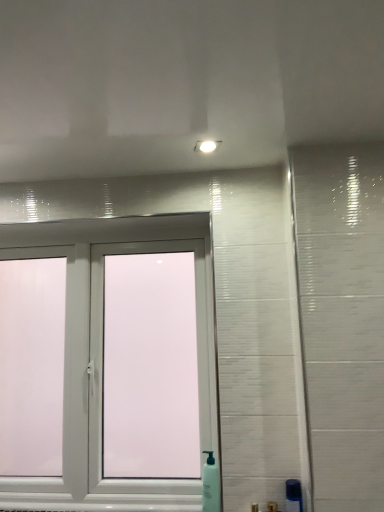
What are the coordinates of `white plastic window at center` in the screenshot? It's located at (102, 355).

This screenshot has height=512, width=384. What do you see at coordinates (102, 355) in the screenshot? I see `white plastic window at center` at bounding box center [102, 355].

In order to click on green translucent soap dispenser at lower right, acting as the second soap dispenser starting from the left in this screenshot , I will do `click(293, 496)`.

Who is bigger, green translucent soap dispenser at lower right, the second soap dispenser when ordered from back to front, or white plastic soap dispenser at lower center, arranged as the 1th soap dispenser when viewed from the back?

Bigger between the two is white plastic soap dispenser at lower center, arranged as the 1th soap dispenser when viewed from the back.

Is green translucent soap dispenser at lower right, acting as the second soap dispenser starting from the left, beside white plastic soap dispenser at lower center, placed as the second soap dispenser when sorted from front to back?

No, green translucent soap dispenser at lower right, acting as the second soap dispenser starting from the left, is not next to white plastic soap dispenser at lower center, placed as the second soap dispenser when sorted from front to back.

From a real-world perspective, is green translucent soap dispenser at lower right, which appears as the first soap dispenser when viewed from the front, located higher than white plastic soap dispenser at lower center, positioned as the first soap dispenser in left-to-right order?

No, from a real-world perspective, green translucent soap dispenser at lower right, which appears as the first soap dispenser when viewed from the front, is not over white plastic soap dispenser at lower center, positioned as the first soap dispenser in left-to-right order

Is green translucent soap dispenser at lower right, the second soap dispenser when ordered from back to front, completely or partially outside of white plastic soap dispenser at lower center, placed as the second soap dispenser when sorted from front to back?

Yes, green translucent soap dispenser at lower right, the second soap dispenser when ordered from back to front, is outside of white plastic soap dispenser at lower center, placed as the second soap dispenser when sorted from front to back.

From a real-world perspective, is green translucent soap dispenser at lower right, the second soap dispenser when ordered from back to front, positioned under white plastic window at center based on gravity?

Yes, from a real-world perspective, green translucent soap dispenser at lower right, the second soap dispenser when ordered from back to front, is under white plastic window at center.

Considering the sizes of objects green translucent soap dispenser at lower right, which appears as the first soap dispenser when viewed from the front, and white plastic window at center in the image provided, who is bigger, green translucent soap dispenser at lower right, which appears as the first soap dispenser when viewed from the front, or white plastic window at center?

Bigger between the two is white plastic window at center.

Is green translucent soap dispenser at lower right, marked as the first soap dispenser in a right-to-left arrangement, aimed at white plastic window at center?

No, green translucent soap dispenser at lower right, marked as the first soap dispenser in a right-to-left arrangement, is not oriented towards white plastic window at center.

Is white plastic window at center bigger than green translucent soap dispenser at lower right, acting as the second soap dispenser starting from the left?

Indeed, white plastic window at center has a larger size compared to green translucent soap dispenser at lower right, acting as the second soap dispenser starting from the left.

Based on the photo, is white plastic window at center wider or thinner than green translucent soap dispenser at lower right, marked as the first soap dispenser in a right-to-left arrangement?

Clearly, white plastic window at center has more width compared to green translucent soap dispenser at lower right, marked as the first soap dispenser in a right-to-left arrangement.

From the image's perspective, is white plastic window at center above green translucent soap dispenser at lower right, acting as the second soap dispenser starting from the left?

Yes, from the image's perspective, white plastic window at center is above green translucent soap dispenser at lower right, acting as the second soap dispenser starting from the left.

Which object is closer to the camera, white plastic window at center or white plastic soap dispenser at lower center, placed as the second soap dispenser when sorted from front to back?

white plastic soap dispenser at lower center, placed as the second soap dispenser when sorted from front to back, is in front.

Looking at the image, does white plastic window at center seem bigger or smaller compared to white plastic soap dispenser at lower center, placed as the second soap dispenser when sorted from front to back?

In the image, white plastic window at center appears to be larger than white plastic soap dispenser at lower center, placed as the second soap dispenser when sorted from front to back.

Can you see white plastic window at center touching white plastic soap dispenser at lower center, which is the 2th soap dispenser from right to left?

No, white plastic window at center is not in contact with white plastic soap dispenser at lower center, which is the 2th soap dispenser from right to left.

Is white plastic soap dispenser at lower center, positioned as the first soap dispenser in left-to-right order, oriented towards white plastic window at center?

No, white plastic soap dispenser at lower center, positioned as the first soap dispenser in left-to-right order, is not turned towards white plastic window at center.

Can we say white plastic soap dispenser at lower center, positioned as the first soap dispenser in left-to-right order, lies outside white plastic window at center?

Yes.

Does white plastic soap dispenser at lower center, positioned as the first soap dispenser in left-to-right order, have a greater width compared to green translucent soap dispenser at lower right, marked as the first soap dispenser in a right-to-left arrangement?

No, white plastic soap dispenser at lower center, positioned as the first soap dispenser in left-to-right order, is not wider than green translucent soap dispenser at lower right, marked as the first soap dispenser in a right-to-left arrangement.

Locate an element on the screen. Image resolution: width=384 pixels, height=512 pixels. soap dispenser behind the green translucent soap dispenser at lower right, the second soap dispenser when ordered from back to front is located at coordinates (210, 484).

How many degrees apart are the facing directions of white plastic soap dispenser at lower center, positioned as the first soap dispenser in left-to-right order, and green translucent soap dispenser at lower right, marked as the first soap dispenser in a right-to-left arrangement?

The facing directions of white plastic soap dispenser at lower center, positioned as the first soap dispenser in left-to-right order, and green translucent soap dispenser at lower right, marked as the first soap dispenser in a right-to-left arrangement, are 22.5 degrees apart.

Based on the photo, is white plastic soap dispenser at lower center, positioned as the first soap dispenser in left-to-right order, completely or partially outside of green translucent soap dispenser at lower right, the second soap dispenser when ordered from back to front?

Indeed, white plastic soap dispenser at lower center, positioned as the first soap dispenser in left-to-right order, is completely outside green translucent soap dispenser at lower right, the second soap dispenser when ordered from back to front.

Where is `soap dispenser lying below the green translucent soap dispenser at lower right, which appears as the first soap dispenser when viewed from the front (from the image's perspective)`? soap dispenser lying below the green translucent soap dispenser at lower right, which appears as the first soap dispenser when viewed from the front (from the image's perspective) is located at coordinates (210, 484).

The height and width of the screenshot is (512, 384). Identify the location of window above the green translucent soap dispenser at lower right, which appears as the first soap dispenser when viewed from the front (from a real-world perspective). (102, 355).

Estimate the real-world distances between objects in this image. Which object is closer to white plastic window at center, white plastic soap dispenser at lower center, placed as the second soap dispenser when sorted from front to back, or green translucent soap dispenser at lower right, which appears as the first soap dispenser when viewed from the front?

Among the two, white plastic soap dispenser at lower center, placed as the second soap dispenser when sorted from front to back, is located nearer to white plastic window at center.

From the image, which object appears to be farther from white plastic soap dispenser at lower center, positioned as the first soap dispenser in left-to-right order, green translucent soap dispenser at lower right, the second soap dispenser when ordered from back to front, or white plastic window at center?

Among the two, white plastic window at center is located further to white plastic soap dispenser at lower center, positioned as the first soap dispenser in left-to-right order.

Looking at the image, which one is located further to green translucent soap dispenser at lower right, marked as the first soap dispenser in a right-to-left arrangement, white plastic window at center or white plastic soap dispenser at lower center, arranged as the 1th soap dispenser when viewed from the back?

Among the two, white plastic window at center is located further to green translucent soap dispenser at lower right, marked as the first soap dispenser in a right-to-left arrangement.

Based on their spatial positions, is white plastic soap dispenser at lower center, placed as the second soap dispenser when sorted from front to back, or white plastic window at center closer to green translucent soap dispenser at lower right, acting as the second soap dispenser starting from the left?

Based on the image, white plastic soap dispenser at lower center, placed as the second soap dispenser when sorted from front to back, appears to be nearer to green translucent soap dispenser at lower right, acting as the second soap dispenser starting from the left.

Looking at the image, which one is located further to white plastic window at center, green translucent soap dispenser at lower right, acting as the second soap dispenser starting from the left, or white plastic soap dispenser at lower center, arranged as the 1th soap dispenser when viewed from the back?

The object further to white plastic window at center is green translucent soap dispenser at lower right, acting as the second soap dispenser starting from the left.

Based on their spatial positions, is white plastic window at center or green translucent soap dispenser at lower right, marked as the first soap dispenser in a right-to-left arrangement, closer to white plastic soap dispenser at lower center, positioned as the first soap dispenser in left-to-right order?

The object closer to white plastic soap dispenser at lower center, positioned as the first soap dispenser in left-to-right order, is green translucent soap dispenser at lower right, marked as the first soap dispenser in a right-to-left arrangement.

In order to click on soap dispenser situated between white plastic window at center and green translucent soap dispenser at lower right, acting as the second soap dispenser starting from the left, from left to right in this screenshot , I will do `click(210, 484)`.